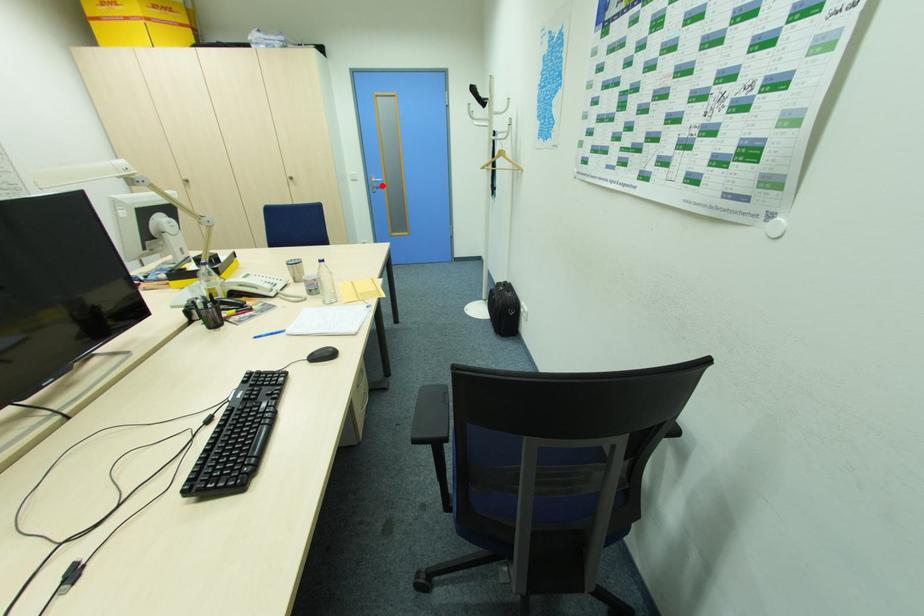
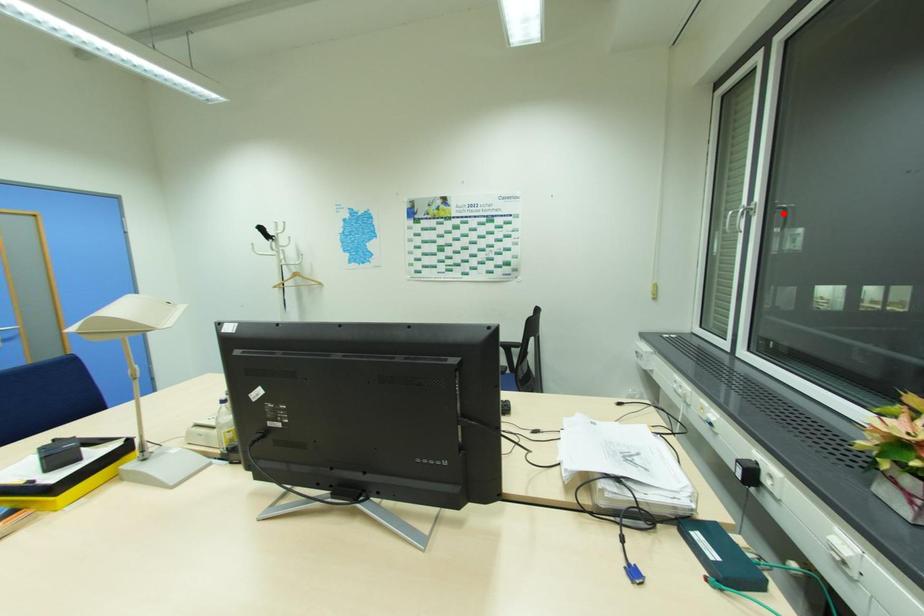
I am providing you with two images of the same scene from different viewpoints. A red point is marked on the first image and another point is marked on the second image. Does the point marked in image1 correspond to the same location as the one in image2?

No